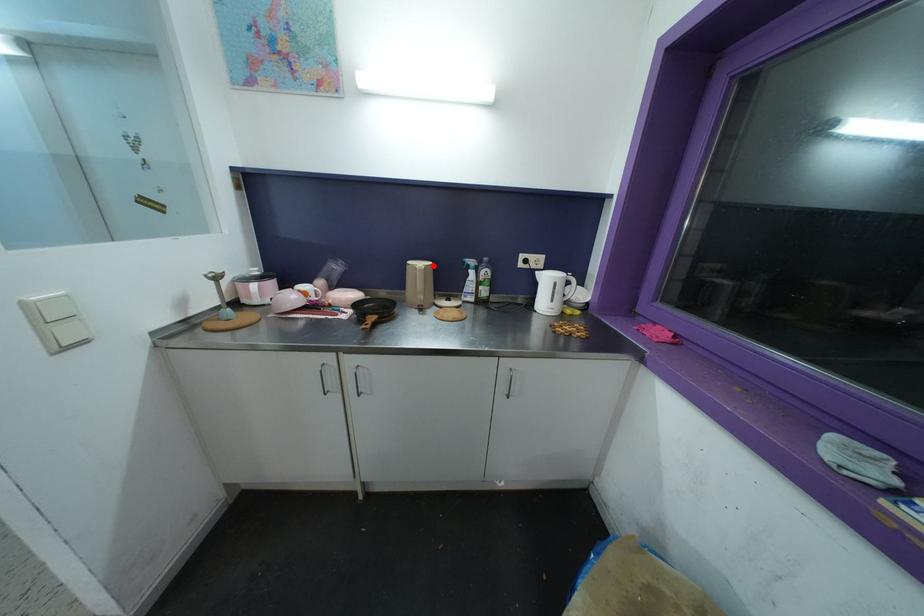
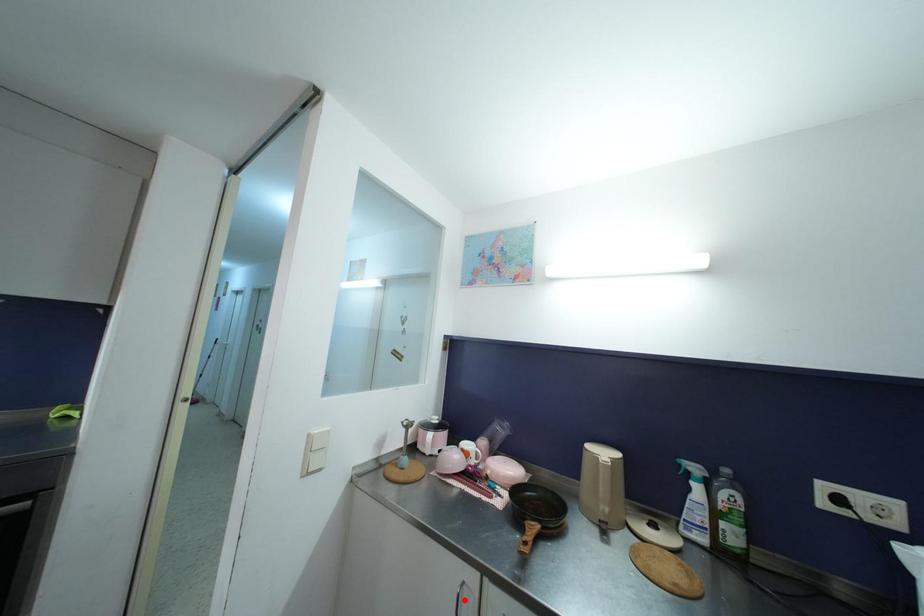
I am providing you with two images of the same scene from different viewpoints. A red point is marked on the first image and another point is marked on the second image. Is the marked point in image1 the same physical position as the marked point in image2?

No